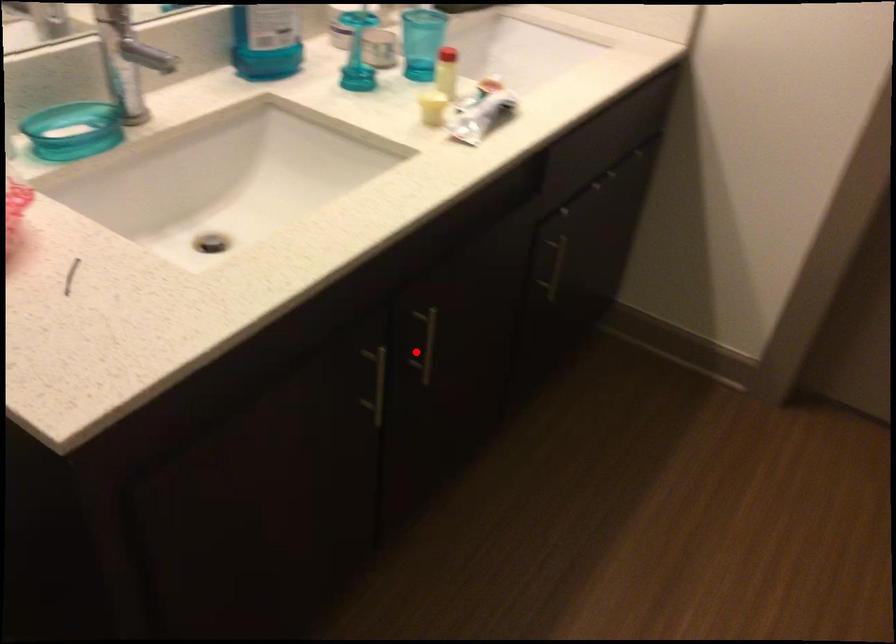
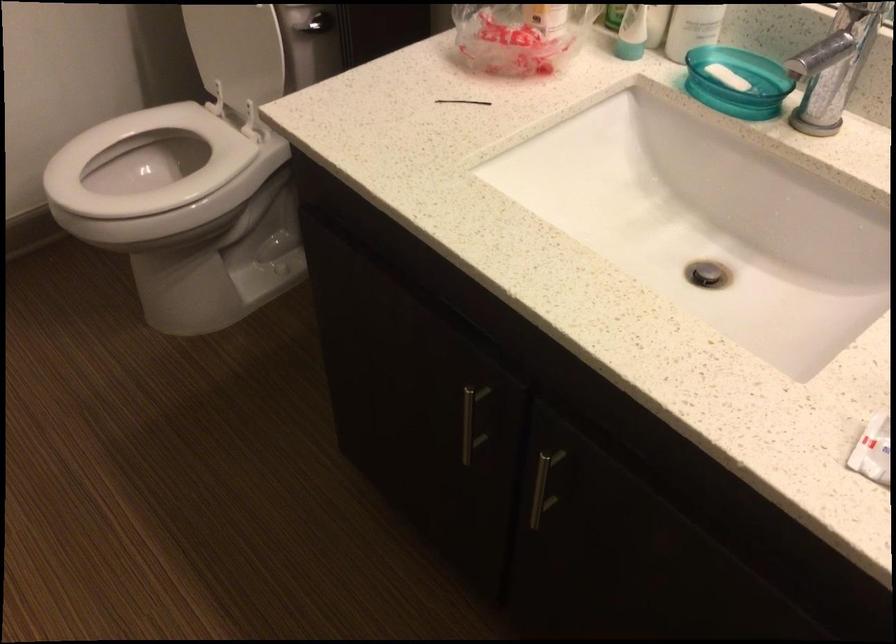
Question: I am providing you with two images of the same scene from different viewpoints. In image1, a red point is highlighted. Considering the same 3D point in image2, which of the following is correct?

Choices:
 (A) It is closer
 (B) It is farther

Answer: (A)